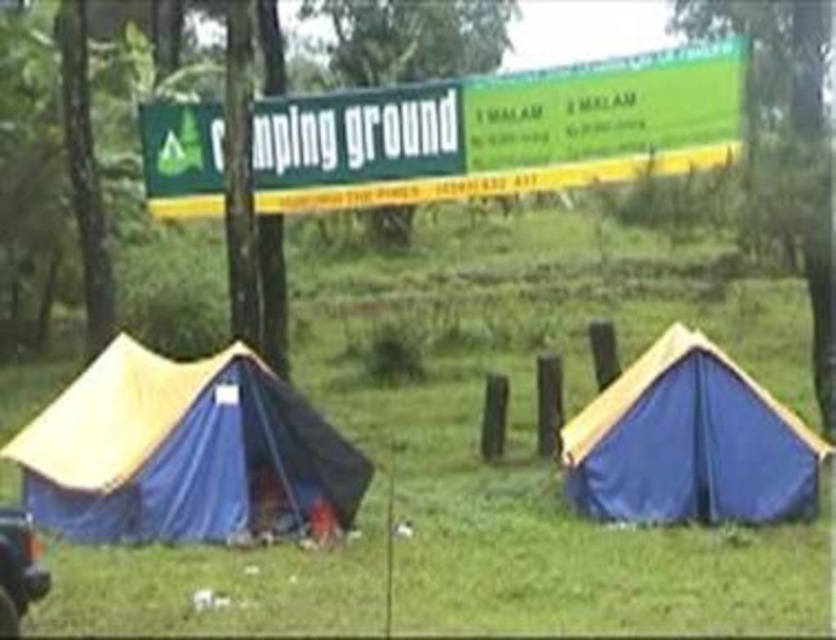
You are a photographer wanting to take a picture of the green grass at center and the shiny black car at lower left. From your current position, can you see both objects clearly in the frame without moving?

The shiny black car at lower left is behind the green grass at center, so the car may be partially or fully obscured by the grass, making it difficult to see both clearly in the same frame without moving.

You are a camper who wants to set up a new tent in the camping area. The existing tents are located at specific points. You have coordinates for a spot where you want to place your tent. The coordinates are point (181, 451). Is there already a tent at this location?

Yes, there is already a tent at point (181, 451). The blue fabric tent at left is located there.